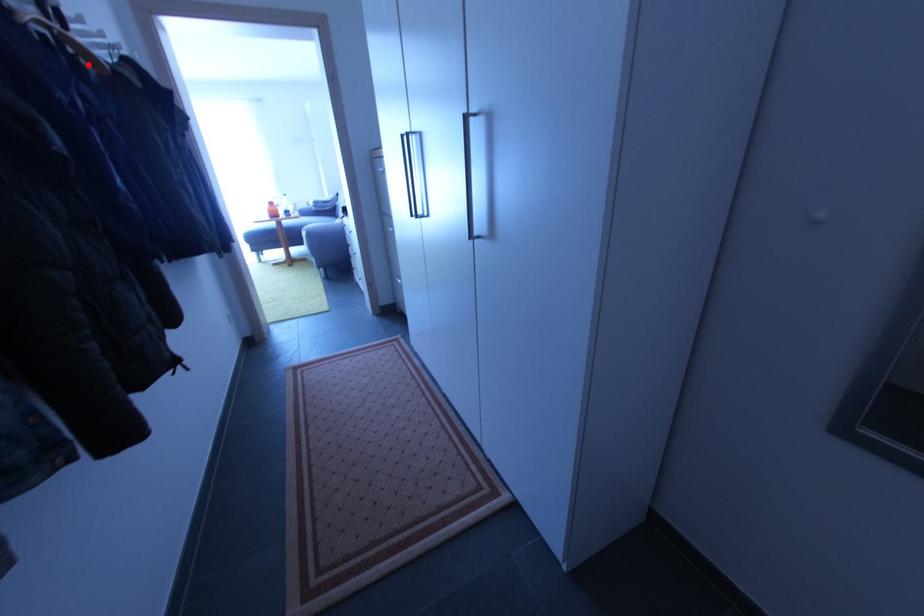
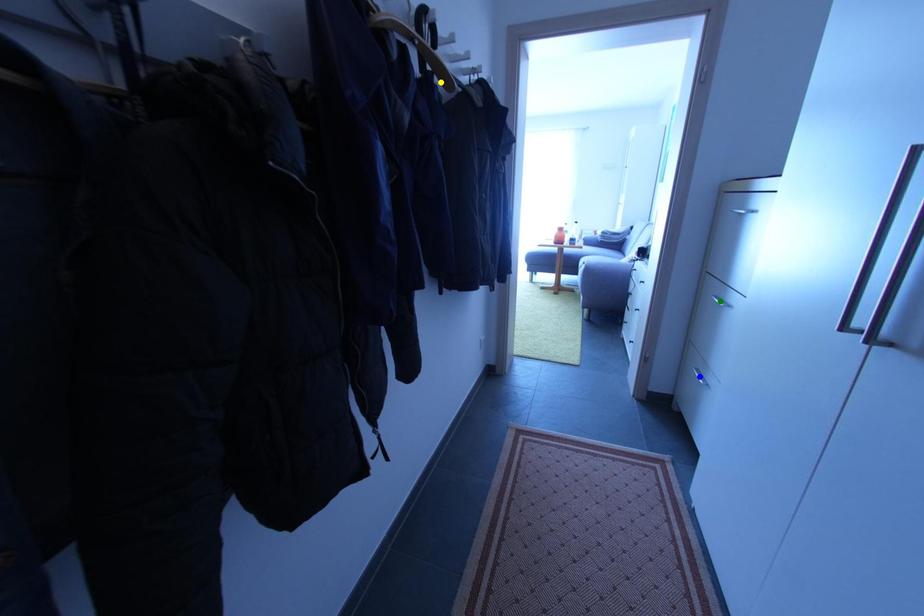
Question: I am providing you with two images of the same scene from different viewpoints. A red point is marked on the first image. You are given multiple points on the second image. Which point in image 2 represents the same 3d spot as the red point in image 1?

Choices:
 (A) yellow point
 (B) blue point
 (C) green point

Answer: (A)